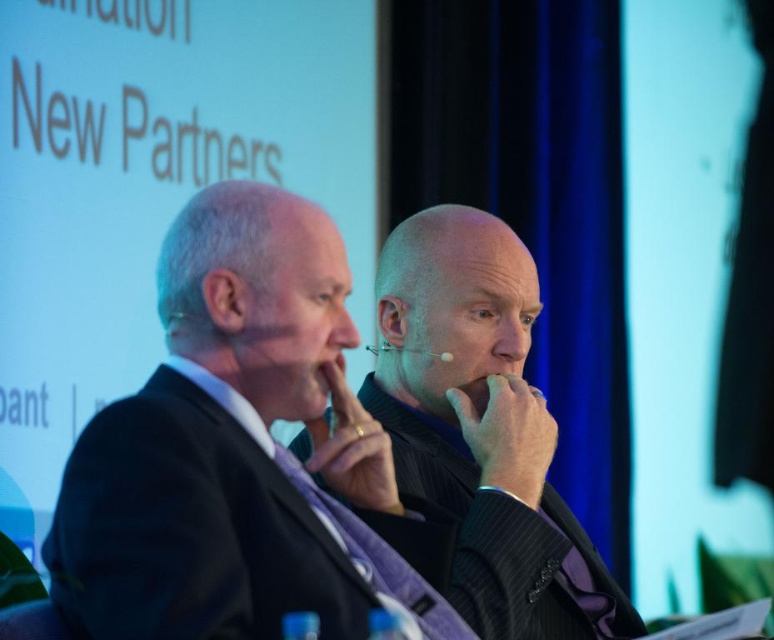
You are a photographer standing in front of the black pinstripe suit at center. You want to take a closeup photo of the suit. The camera you are using has a minimum focusing distance of 1.5 meters. Can you take the photo without moving closer?

The distance of black pinstripe suit at center from camera is 1.74 meters, which is greater than the camera minimum focusing distance of 1.5 meters. So yes, you can take the photo without moving closer.

You are a photographer at a formal event. You need to capture a clear photo of the black pinstripe suit at center and the black textured suit at center. Which one should you focus on first to ensure both are in focus?

The black pinstripe suit at center is in front of the black textured suit at center, so you should focus on the black pinstripe suit at center first to ensure both are in focus.

You are a photographer adjusting the focus on your camera. You need to focus on either the point at (62, 515) or the point at (461, 232). Which point should you focus on if you want the closest object to be in sharp focus?

You should focus on point (62, 515) because it is closer to the camera than point (461, 232).